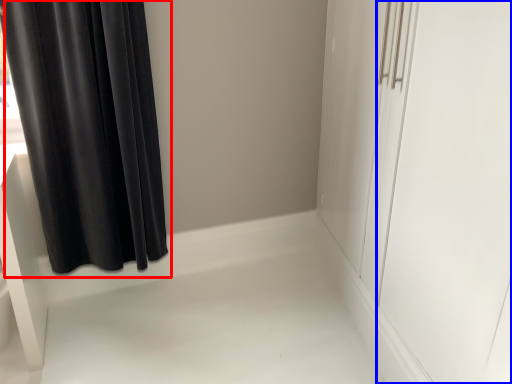
Question: Which point is closer to the camera, curtain (highlighted by a red box) or screen door (highlighted by a blue box)?

Choices:
 (A) curtain
 (B) screen door

Answer: (B)